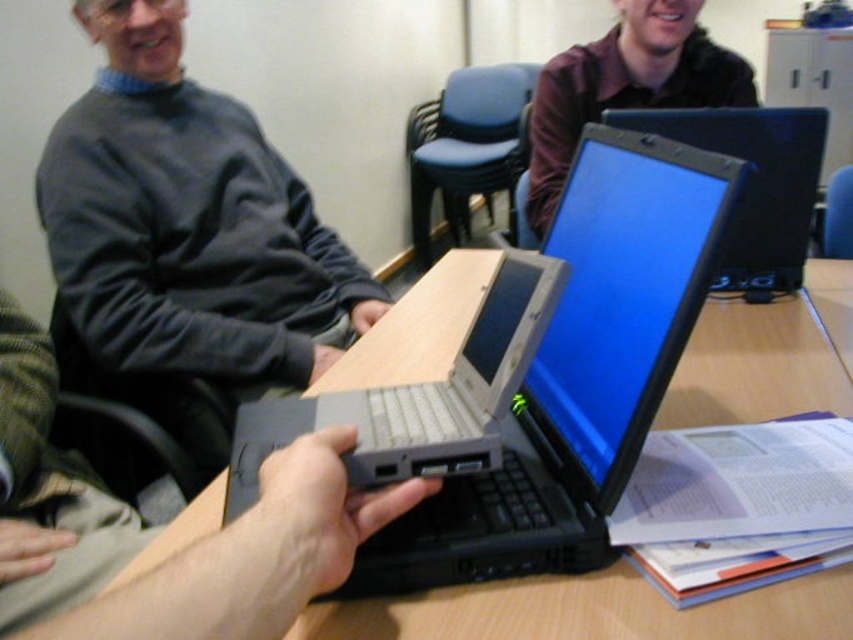
You are a participant in the meeting and need to place a document on the wooden table at center. However, there is a person wearing the matte brown shirt at upper center sitting there. Where should you place the document to avoid blocking their view?

Place the document on the wooden table at center below the matte brown shirt at upper center to avoid blocking their view.

You are standing in front of the scene described. Where is the wooden table at center located in terms of coordinates?

The wooden table at center is located at coordinates point (589, 612).